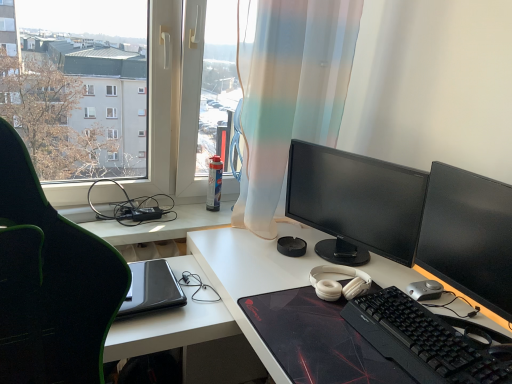
The image size is (512, 384). Find the location of `vacant region to the left of black matte keyboard at lower right`. vacant region to the left of black matte keyboard at lower right is located at coordinates (322, 336).